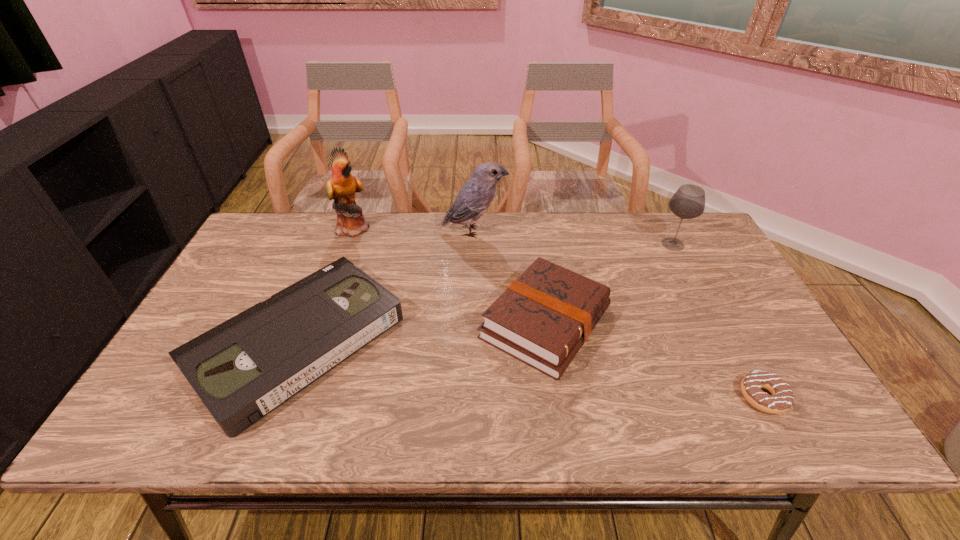
Where is `the tallest object`? the tallest object is located at coordinates (342, 185).

You are a GUI agent. You are given a task and a screenshot of the screen. Output one action in this format:
    pyautogui.click(x=<x>, y=<y>)
    Task: Click on the taller parrot
    This screenshot has height=540, width=960.
    Given the screenshot: What is the action you would take?
    pyautogui.click(x=342, y=185)

Identify the location of the right parrot. Image resolution: width=960 pixels, height=540 pixels. (475, 197).

Find the location of a particular element. the shorter parrot is located at coordinates (475, 197).

The width and height of the screenshot is (960, 540). Identify the location of wineglass. (688, 202).

You are a GUI agent. You are given a task and a screenshot of the screen. Output one action in this format:
    pyautogui.click(x=<x>, y=<y>)
    Task: Click on the fourth tallest object
    Image resolution: width=960 pixels, height=540 pixels.
    Given the screenshot: What is the action you would take?
    pyautogui.click(x=545, y=316)

Find the location of a particular element. This screenshot has height=540, width=960. the second shortest object is located at coordinates (244, 368).

Image resolution: width=960 pixels, height=540 pixels. In order to click on the shortest object in this screenshot , I will do `click(782, 397)`.

The image size is (960, 540). I want to click on vacant space positioned on the front-facing side of the left parrot, so click(x=438, y=228).

Where is `vacant point located on the front-facing side of the second tallest object`? vacant point located on the front-facing side of the second tallest object is located at coordinates (549, 231).